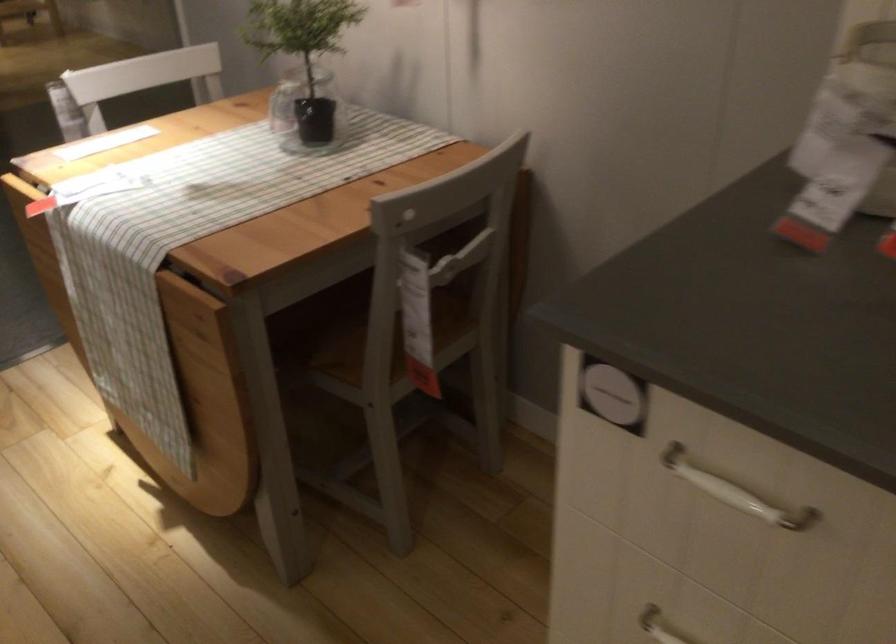
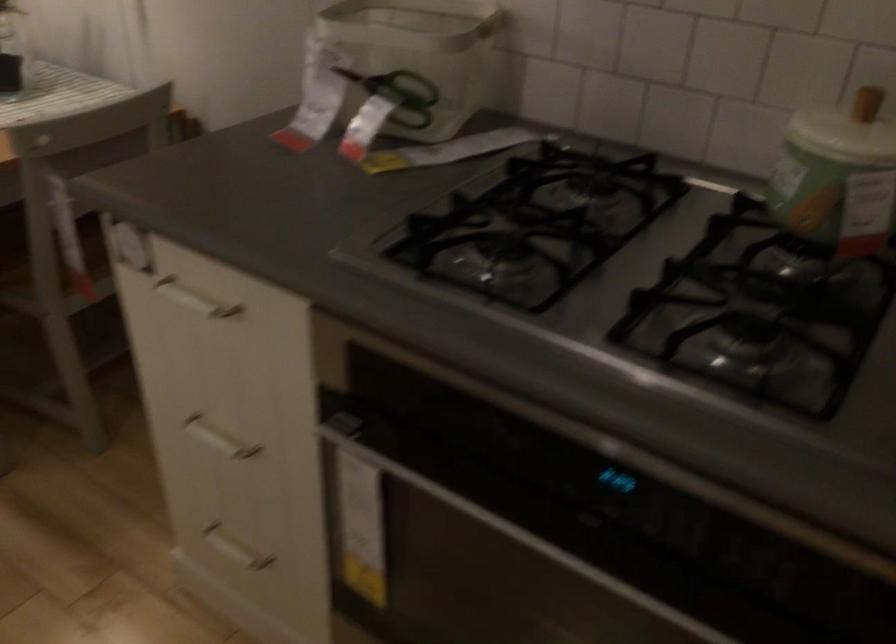
The point at (712, 478) is marked in the first image. Where is the corresponding point in the second image?

(194, 299)